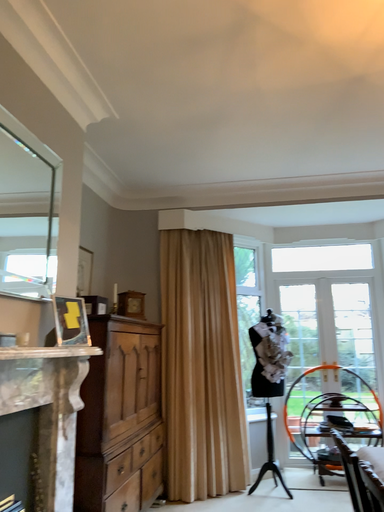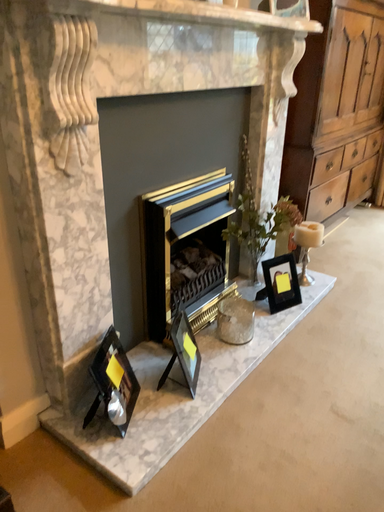
Question: Which way did the camera rotate in the video?

Choices:
 (A) rotated left
 (B) rotated right

Answer: (A)